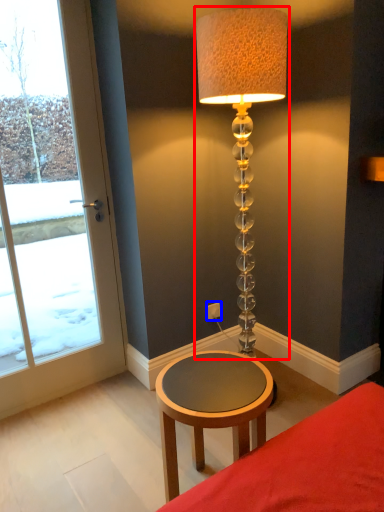
Question: Which of the following is the closest to the observer, lamp (highlighted by a red box) or electric outlet (highlighted by a blue box)?

Choices:
 (A) lamp
 (B) electric outlet

Answer: (A)